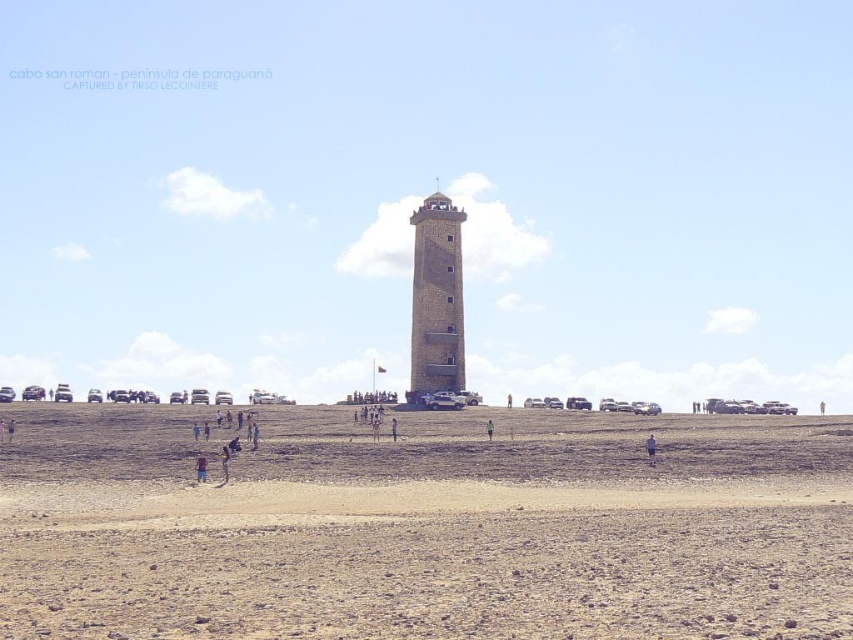
Question: Among these objects, which one is nearest to the camera?

Choices:
 (A) brown sandy dirt field at center
 (B) brown stone tower at center

Answer: (A)

Question: Is brown stone tower at center further to the viewer compared to gray fabric pants at lower center?

Choices:
 (A) no
 (B) yes

Answer: (B)

Question: Does brown fabric shirt at lower center lie behind gray fabric pants at lower center?

Choices:
 (A) no
 (B) yes

Answer: (A)

Question: Which of the following is the closest to the observer?

Choices:
 (A) brown stone tower at center
 (B) green fabric person at center
 (C) brown fabric shirt at lower center
 (D) brown leather shoes at lower center

Answer: (C)

Question: Is the position of brown stone tower at center more distant than that of brown leather shoes at lower center?

Choices:
 (A) yes
 (B) no

Answer: (A)

Question: Which point is farther from the camera taking this photo?

Choices:
 (A) (222, 445)
 (B) (450, 282)
 (C) (648, 445)
 (D) (198, 474)

Answer: (B)